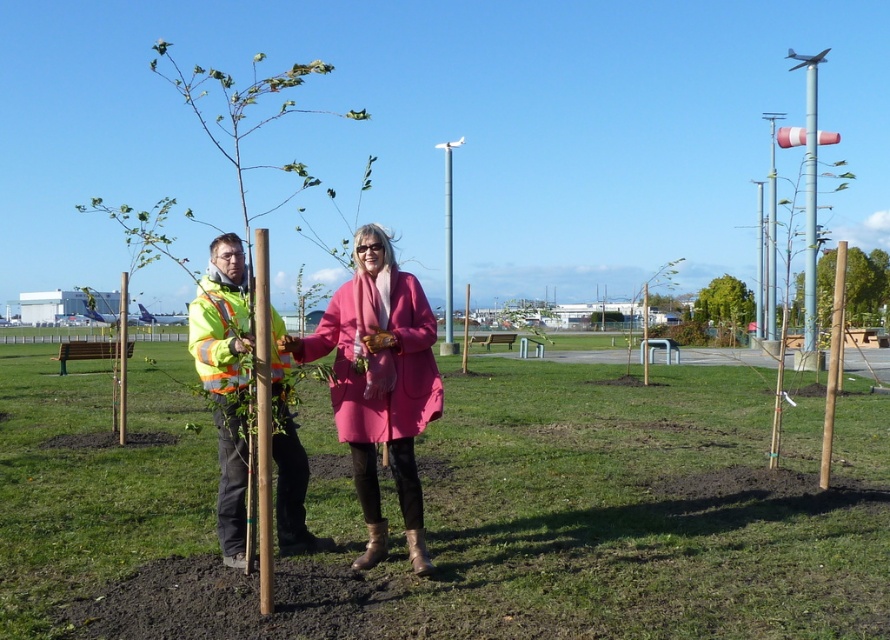
Does brown wood pole at center come in front of green matte pole at upper right?

Yes, brown wood pole at center is closer to the viewer.

Image resolution: width=890 pixels, height=640 pixels. Identify the location of brown wood pole at center. (263, 417).

Between high visibility jacket at center and brushed metal pole at center, which one appears on the left side from the viewer's perspective?

brushed metal pole at center is more to the left.

Is point (225, 365) more distant than point (122, 340)?

No.

Between point (247, 333) and point (126, 355), which one is positioned behind?

Positioned behind is point (126, 355).

I want to click on high visibility jacket at center, so click(x=224, y=378).

Can you confirm if brown wood pole at center is wider than brushed metal pole at center?

No.

Can you confirm if brown wood pole at center is positioned below brushed metal pole at center?

Yes.

Who is more forward, (269, 564) or (126, 321)?

Positioned in front is point (269, 564).

The width and height of the screenshot is (890, 640). I want to click on brown wood pole at center, so click(x=263, y=417).